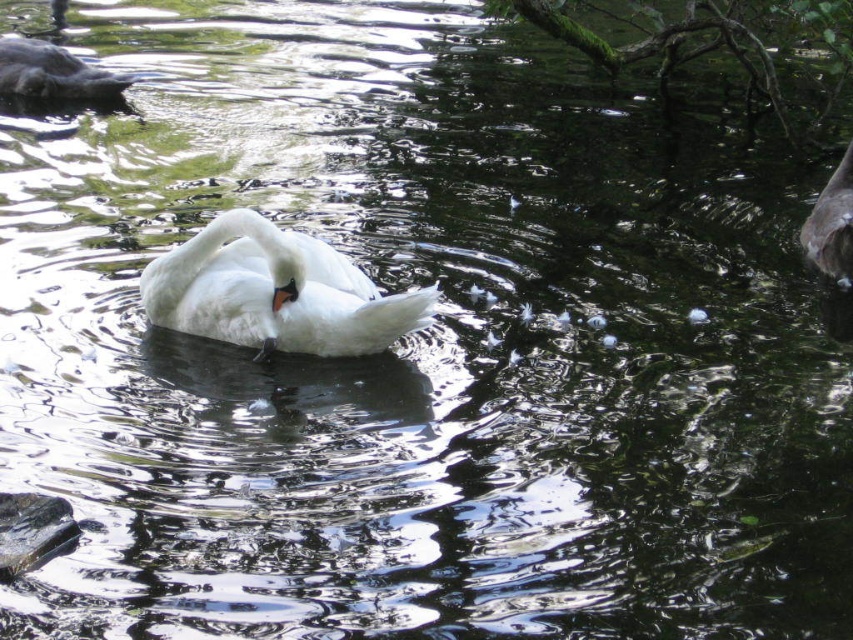
Question: Does white feathered swan at center appear on the left side of dark gray duck at upper left?

Choices:
 (A) no
 (B) yes

Answer: (A)

Question: Which object appears farthest from the camera in this image?

Choices:
 (A) dark gray feathers at upper right
 (B) white feathered swan at center

Answer: (A)

Question: Which of the following is the farthest from the observer?

Choices:
 (A) (840, 241)
 (B) (396, 301)

Answer: (A)

Question: Is the position of white feathered swan at center more distant than that of dark gray feathers at upper right?

Choices:
 (A) no
 (B) yes

Answer: (A)

Question: From the image, what is the correct spatial relationship of dark gray duck at upper left in relation to dark gray feathers at upper right?

Choices:
 (A) above
 (B) below

Answer: (A)

Question: Estimate the real-world distances between objects in this image. Which object is farther from the white feathered swan at center?

Choices:
 (A) dark gray duck at upper left
 (B) dark gray feathers at upper right

Answer: (A)